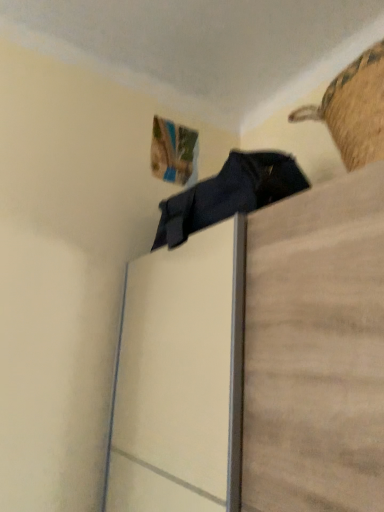
Question: Considering the relative positions of matte black clothing at upper center and woven straw basket at upper right in the image provided, is matte black clothing at upper center to the right of woven straw basket at upper right from the viewer's perspective?

Choices:
 (A) yes
 (B) no

Answer: (B)

Question: Does matte black clothing at upper center have a greater width compared to woven straw basket at upper right?

Choices:
 (A) yes
 (B) no

Answer: (A)

Question: Does matte black clothing at upper center have a larger size compared to woven straw basket at upper right?

Choices:
 (A) no
 (B) yes

Answer: (B)

Question: From the image's perspective, would you say matte black clothing at upper center is shown under woven straw basket at upper right?

Choices:
 (A) no
 (B) yes

Answer: (B)

Question: From the image's perspective, is matte black clothing at upper center located above woven straw basket at upper right?

Choices:
 (A) yes
 (B) no

Answer: (B)

Question: Does matte black clothing at upper center contain woven straw basket at upper right?

Choices:
 (A) yes
 (B) no

Answer: (B)

Question: From a real-world perspective, is woven straw basket at upper right below matte black clothing at upper center?

Choices:
 (A) no
 (B) yes

Answer: (A)

Question: Would you say woven straw basket at upper right is a long distance from matte black clothing at upper center?

Choices:
 (A) yes
 (B) no

Answer: (A)

Question: Considering the relative sizes of woven straw basket at upper right and matte black clothing at upper center in the image provided, is woven straw basket at upper right taller than matte black clothing at upper center?

Choices:
 (A) yes
 (B) no

Answer: (B)

Question: Considering the relative positions of woven straw basket at upper right and matte black clothing at upper center in the image provided, is woven straw basket at upper right to the right of matte black clothing at upper center from the viewer's perspective?

Choices:
 (A) yes
 (B) no

Answer: (A)

Question: Considering the relative positions of woven straw basket at upper right and matte black clothing at upper center in the image provided, is woven straw basket at upper right to the left of matte black clothing at upper center from the viewer's perspective?

Choices:
 (A) no
 (B) yes

Answer: (A)

Question: Does woven straw basket at upper right lie behind matte black clothing at upper center?

Choices:
 (A) yes
 (B) no

Answer: (A)

Question: Considering the positions of matte black clothing at upper center and woven straw basket at upper right in the image, is matte black clothing at upper center wider or thinner than woven straw basket at upper right?

Choices:
 (A) thin
 (B) wide

Answer: (B)